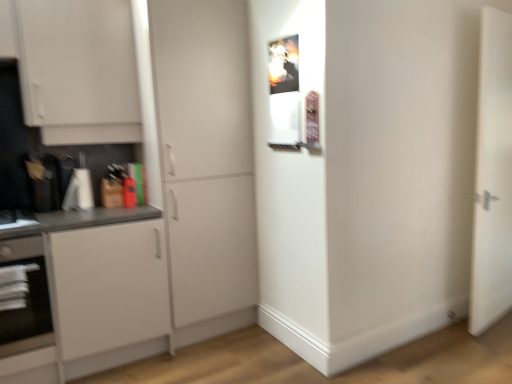
Question: Is black glass oven at lower left shorter than white matte cabinet at center, marked as the 1th door in a left-to-right arrangement?

Choices:
 (A) yes
 (B) no

Answer: (A)

Question: Does black glass oven at lower left have a smaller size compared to white matte cabinet at center, arranged as the 2th door when viewed from the right?

Choices:
 (A) no
 (B) yes

Answer: (B)

Question: Is black glass oven at lower left behind white matte cabinet at center, arranged as the 2th door when viewed from the right?

Choices:
 (A) yes
 (B) no

Answer: (B)

Question: Is white matte cabinet at center, arranged as the 2th door when viewed from the right, at the back of black glass oven at lower left?

Choices:
 (A) yes
 (B) no

Answer: (B)

Question: Is black glass oven at lower left thinner than white matte cabinet at center, marked as the 1th door in a left-to-right arrangement?

Choices:
 (A) yes
 (B) no

Answer: (A)

Question: Is white matte door at right, which appears as the 2th door when viewed from the left, bigger or smaller than white matte cabinet at left?

Choices:
 (A) big
 (B) small

Answer: (B)

Question: In terms of width, does white matte door at right, arranged as the first door when viewed from the right, look wider or thinner when compared to white matte cabinet at left?

Choices:
 (A) wide
 (B) thin

Answer: (B)

Question: In the image, is white matte door at right, which appears as the 2th door when viewed from the left, on the left side or the right side of white matte cabinet at left?

Choices:
 (A) right
 (B) left

Answer: (A)

Question: Relative to white matte cabinet at left, is white matte door at right, arranged as the first door when viewed from the right, in front or behind?

Choices:
 (A) front
 (B) behind

Answer: (B)

Question: From a real-world perspective, relative to white matte door at right, which appears as the 2th door when viewed from the left, is white matte cabinet at left vertically above or below?

Choices:
 (A) above
 (B) below

Answer: (B)

Question: Is point (128, 283) closer or farther from the camera than point (488, 173)?

Choices:
 (A) closer
 (B) farther

Answer: (A)

Question: Is white matte cabinet at left in front of or behind white matte door at right, arranged as the first door when viewed from the right, in the image?

Choices:
 (A) behind
 (B) front

Answer: (B)

Question: In terms of width, does white matte cabinet at left look wider or thinner when compared to white matte door at right, arranged as the first door when viewed from the right?

Choices:
 (A) thin
 (B) wide

Answer: (B)

Question: Is black glass oven at lower left to the left or to the right of white matte cabinet at center, arranged as the 2th door when viewed from the right, in the image?

Choices:
 (A) left
 (B) right

Answer: (A)

Question: From a real-world perspective, is black glass oven at lower left positioned above or below white matte cabinet at center, arranged as the 2th door when viewed from the right?

Choices:
 (A) below
 (B) above

Answer: (A)